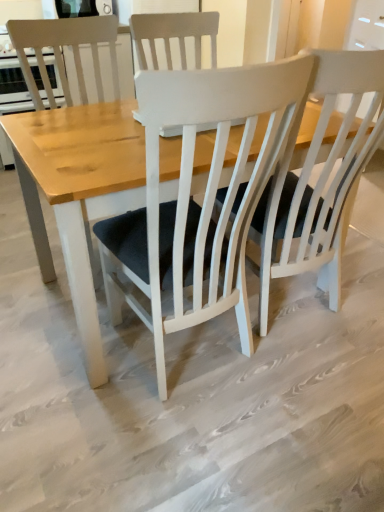
This screenshot has width=384, height=512. Describe the element at coordinates (60, 51) in the screenshot. I see `white wood chair at center` at that location.

In order to face white wood chair at center, should I rotate leftwards or rightwards?

You should rotate left by 12.589 degrees.

Find the location of `white wood chair at center`. white wood chair at center is located at coordinates (60, 51).

What is the approximate height of white wood chair at center?

It is 3.50 feet.

Where is `white wood chair at center`? white wood chair at center is located at coordinates (60, 51).